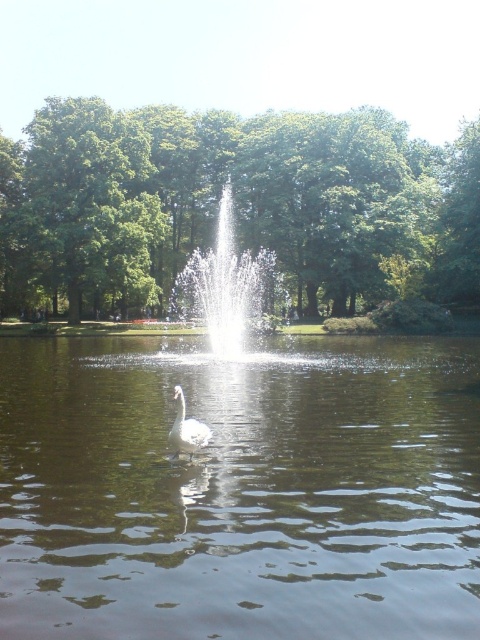
You are a photographer planning to capture the white glossy swan at center and the green leafy tree at upper left in a single frame. Based on their sizes, which object should you focus on first to ensure both are in sharp focus?

The green leafy tree at upper left is larger in size than the white glossy swan at center, so focusing on the tree first would help ensure both are in sharp focus since it occupies more of the frame.

You are a photographer aiming to capture the white glossy swan at center and the green leafy tree at center in a single shot. Based on their sizes, which object should you focus on first to ensure both are in frame?

The green leafy tree at center is larger than the white glossy swan at center, so you should focus on the green leafy tree at center first to ensure both are in frame.